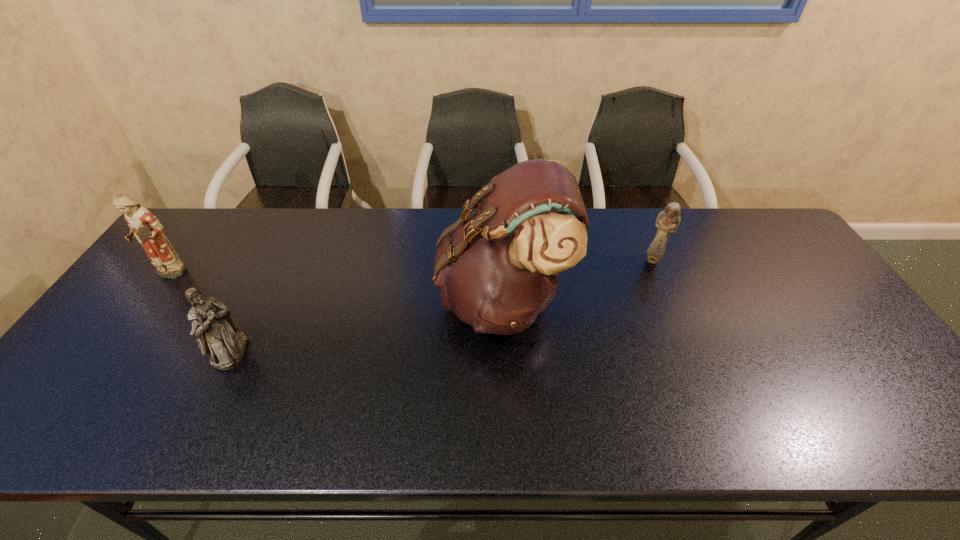
At what (x,y) coordinates should I click in order to perform the action: click on figurine object that ranks as the closest to the third object from left to right. Please return your answer as a coordinate pair (x, y). The width and height of the screenshot is (960, 540). Looking at the image, I should click on (668, 220).

Identify which figurine is located as the nearest to the third shortest object. Please provide its 2D coordinates. Your answer should be formatted as a tuple, i.e. [(x, y)], where the tuple contains the x and y coordinates of a point satisfying the conditions above.

[(216, 332)]

Find the location of a particular element. free space that satisfies the following two spatial constraints: 1. on the front-facing side of the rightmost object; 2. on the front-facing side of the second object from left to right is located at coordinates (692, 352).

At what (x,y) coordinates should I click in order to perform the action: click on free region that satisfies the following two spatial constraints: 1. on the front-facing side of the rightmost object; 2. at the front of the satchel with buckles. Please return your answer as a coordinate pair (x, y). This screenshot has height=540, width=960. Looking at the image, I should click on (670, 300).

Where is `vacant space that satisfies the following two spatial constraints: 1. on the front-facing side of the rightmost figurine; 2. on the front-facing side of the second figurine from right to left`? The height and width of the screenshot is (540, 960). vacant space that satisfies the following two spatial constraints: 1. on the front-facing side of the rightmost figurine; 2. on the front-facing side of the second figurine from right to left is located at coordinates (692, 352).